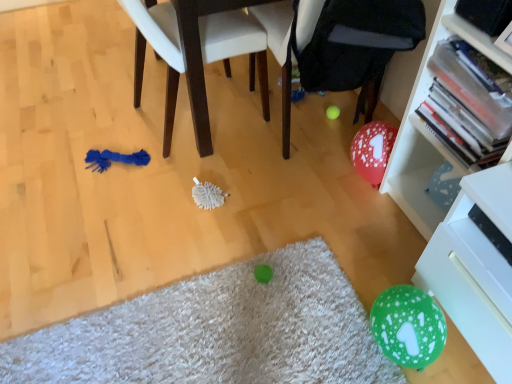
You are a GUI agent. You are given a task and a screenshot of the screen. Output one action in this format:
    pyautogui.click(x=<x>, y=<y>)
    Task: Click on the vacant space behind green fuzzy mat at lower center
    
    Given the screenshot: What is the action you would take?
    pyautogui.click(x=190, y=203)